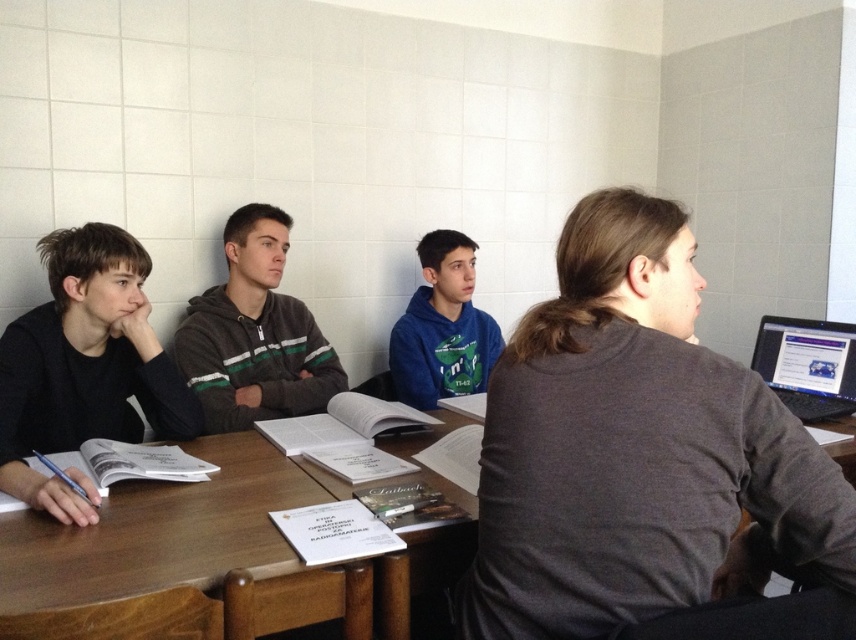
Question: Is brown wooden table at lower center smaller than black matte shirt at left?

Choices:
 (A) yes
 (B) no

Answer: (A)

Question: Among these objects, which one is nearest to the camera?

Choices:
 (A) brown wooden table at lower center
 (B) black glossy laptop at right
 (C) wooden table at center

Answer: (A)

Question: Based on their relative distances, which object is farther from the black glossy laptop at right?

Choices:
 (A) blue fleece jacket at center
 (B) black matte shirt at left
 (C) green striped hoodie at center

Answer: (B)

Question: Which is nearer to the blue fleece jacket at center?

Choices:
 (A) brown wooden table at lower center
 (B) green striped hoodie at center
 (C) gray matte shirt at right
 (D) black glossy laptop at right

Answer: (B)

Question: Can you confirm if brown wooden table at lower center is positioned above black matte shirt at left?

Choices:
 (A) no
 (B) yes

Answer: (A)

Question: Does gray matte shirt at right come in front of brown wooden table at lower center?

Choices:
 (A) no
 (B) yes

Answer: (B)